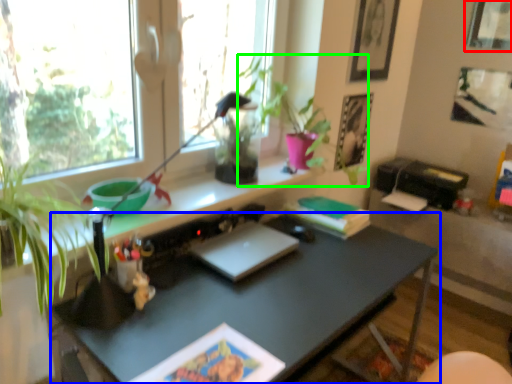
Question: Which object is positioned farthest from picture frame (highlighted by a red box)? Select from desk (highlighted by a blue box) and plant (highlighted by a green box).

Choices:
 (A) desk
 (B) plant

Answer: (A)